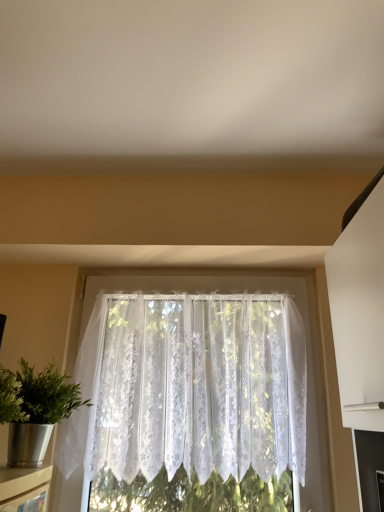
Question: Is metallic silver shelf at lower left bigger or smaller than white lace curtain at center?

Choices:
 (A) big
 (B) small

Answer: (B)

Question: From a real-world perspective, is metallic silver shelf at lower left positioned above or below white lace curtain at center?

Choices:
 (A) below
 (B) above

Answer: (A)

Question: Which object is positioned farthest from the metallic silver houseplant at left?

Choices:
 (A) white lace curtain at center
 (B) metallic silver shelf at lower left

Answer: (A)

Question: Which object is positioned farthest from the metallic silver shelf at lower left?

Choices:
 (A) metallic silver houseplant at left
 (B) white lace curtain at center

Answer: (B)